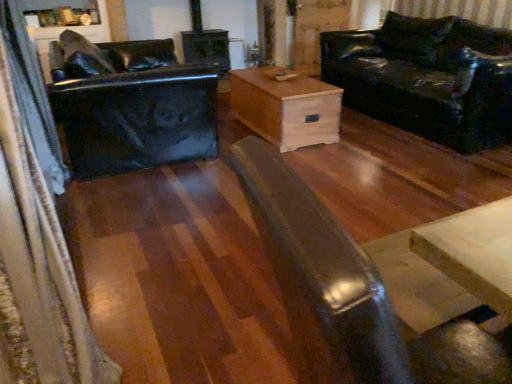
This screenshot has height=384, width=512. I want to click on free space between velvet dark blue curtain at left and glossy black swivel chair at left, so click(x=137, y=231).